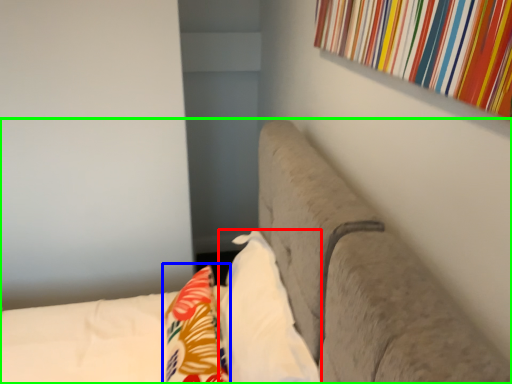
Question: Based on their relative distances, which object is nearer to pillow (highlighted by a red box)? Choose from throw pillow (highlighted by a blue box) and furniture (highlighted by a green box).

Choices:
 (A) throw pillow
 (B) furniture

Answer: (A)